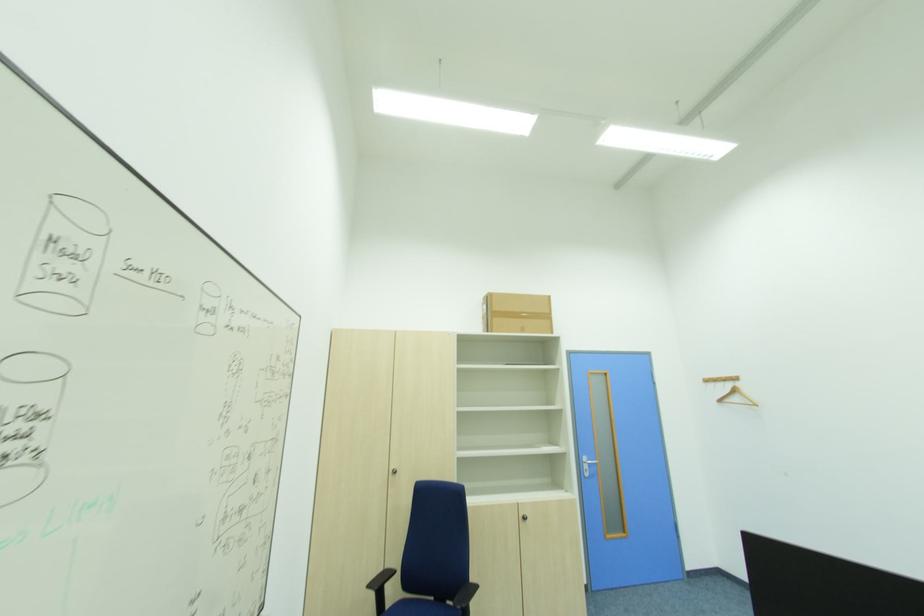
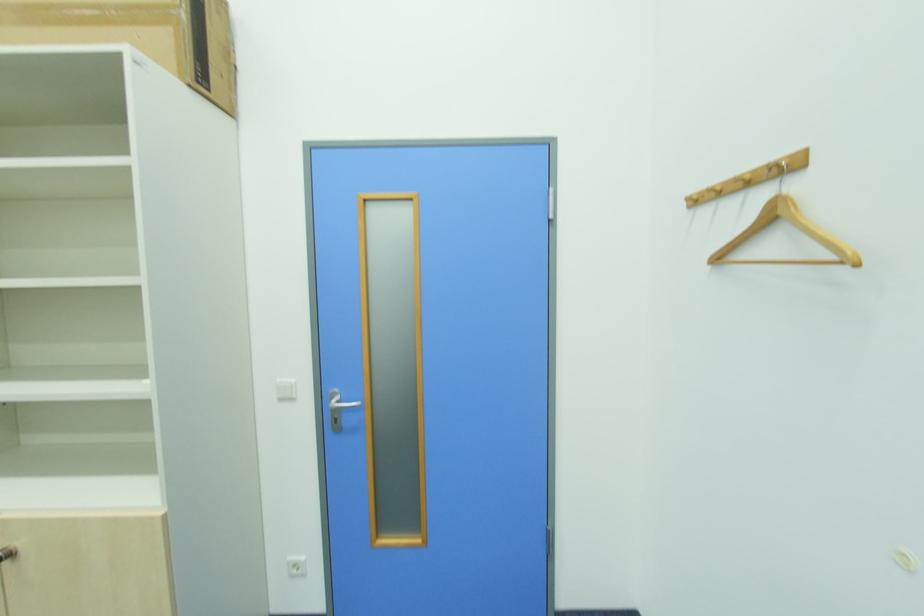
In a continuous first-person perspective shot, in which direction is the camera moving?

The movement direction of the cameraman is right, forward.